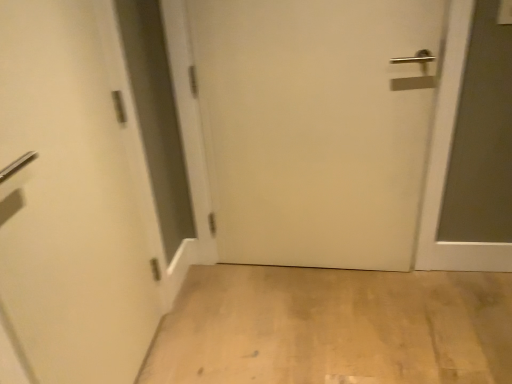
Question: From the image's perspective, relative to white matte door at center, positioned as the first door in right-to-left order, is white matte door at left, which appears as the 1th door when viewed from the left, above or below?

Choices:
 (A) below
 (B) above

Answer: (A)

Question: In terms of size, does white matte door at left, which appears as the 1th door when viewed from the left, appear bigger or smaller than white matte door at center, which appears as the second door when viewed from the left?

Choices:
 (A) small
 (B) big

Answer: (A)

Question: Estimate the real-world distances between objects in this image. Which object is farther from the white matte door at left, placed as the second door when sorted from right to left?

Choices:
 (A) light wood floor at lower center
 (B) white matte door at center, positioned as the first door in right-to-left order

Answer: (A)

Question: Estimate the real-world distances between objects in this image. Which object is closer to the white matte door at left, placed as the second door when sorted from right to left?

Choices:
 (A) white matte door at center, positioned as the first door in right-to-left order
 (B) light wood floor at lower center

Answer: (A)